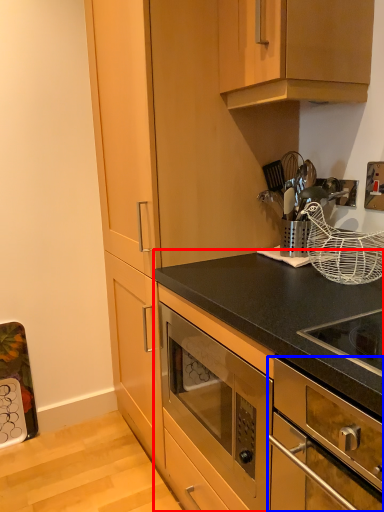
Question: Which object appears farthest to the camera in this image, cabinetry (highlighted by a red box) or oven (highlighted by a blue box)?

Choices:
 (A) cabinetry
 (B) oven

Answer: (A)